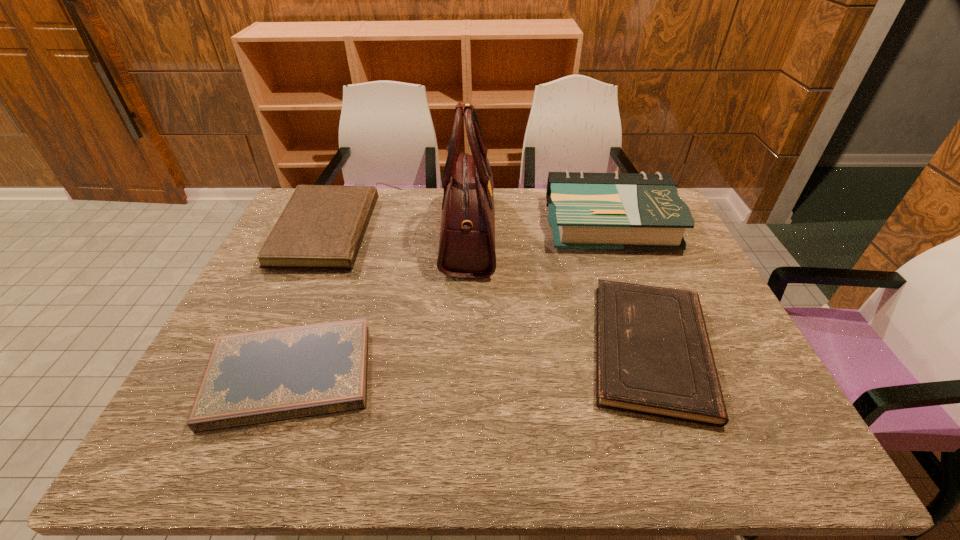
Find the location of a particular element. The width and height of the screenshot is (960, 540). object that is at the far right corner is located at coordinates (642, 211).

Find the location of a particular element. The width and height of the screenshot is (960, 540). object positioned at the near right corner is located at coordinates (653, 355).

Identify the location of free space at the far edge. (547, 225).

At what (x,y) coordinates should I click in order to perform the action: click on vacant area at the near edge. Please return your answer as a coordinate pair (x, y). Looking at the image, I should click on (314, 440).

Find the location of `vacant area at the near right corner`. vacant area at the near right corner is located at coordinates (772, 455).

The image size is (960, 540). What are the coordinates of `object that is the third closest one to the tallest paperback book` in the screenshot? It's located at (321, 227).

Locate which object is the third closest to the third object from right to left. Please provide its 2D coordinates. Your answer should be formatted as a tuple, i.e. [(x, y)], where the tuple contains the x and y coordinates of a point satisfying the conditions above.

[(653, 355)]

Locate which paperback book is the second closest to the second tallest paperback book. Please provide its 2D coordinates. Your answer should be formatted as a tuple, i.e. [(x, y)], where the tuple contains the x and y coordinates of a point satisfying the conditions above.

[(642, 211)]

Identify which paperback book is the fourth closest to the third object from right to left. Please provide its 2D coordinates. Your answer should be formatted as a tuple, i.e. [(x, y)], where the tuple contains the x and y coordinates of a point satisfying the conditions above.

[(256, 377)]